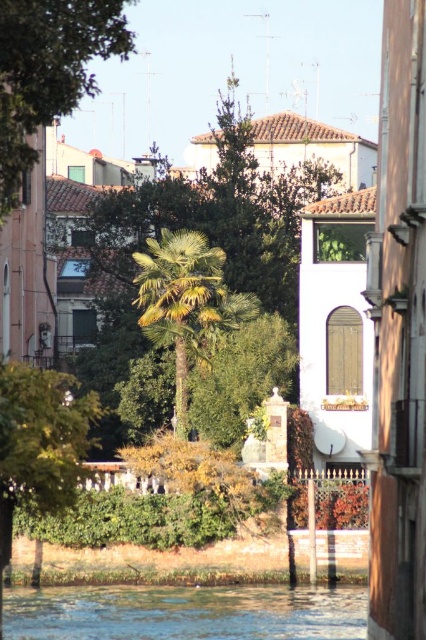
You are standing on the walkway along the waterfront and see the point marked as point (186,612). Based on the scene description, what is the nature of the surface at this point?

The point (186,612) corresponds to clear water at lower center, which is part of the calm water reflecting the light blue sky in the foreground of the scene.

You are an urban planner assessing the layout of this waterfront area. You need to determine if there is enough space between the green leafy tree at center and the green leafy tree at lower left to install a bench that requires 2 meters of width. Based on the provided information, can you confirm if the space between them is sufficient?

The green leafy tree at center might be wider than the green leafy tree at lower left, but the exact distance between them isn t specified. Without knowing the actual spacing, it s uncertain if the 2 meters required for the bench is available.

You are standing at the point with coordinates (210, 243) in the image. Based on the scene description, what object are you currently positioned on?

The point at coordinates (210, 243) is located on the green leafy tree at center.